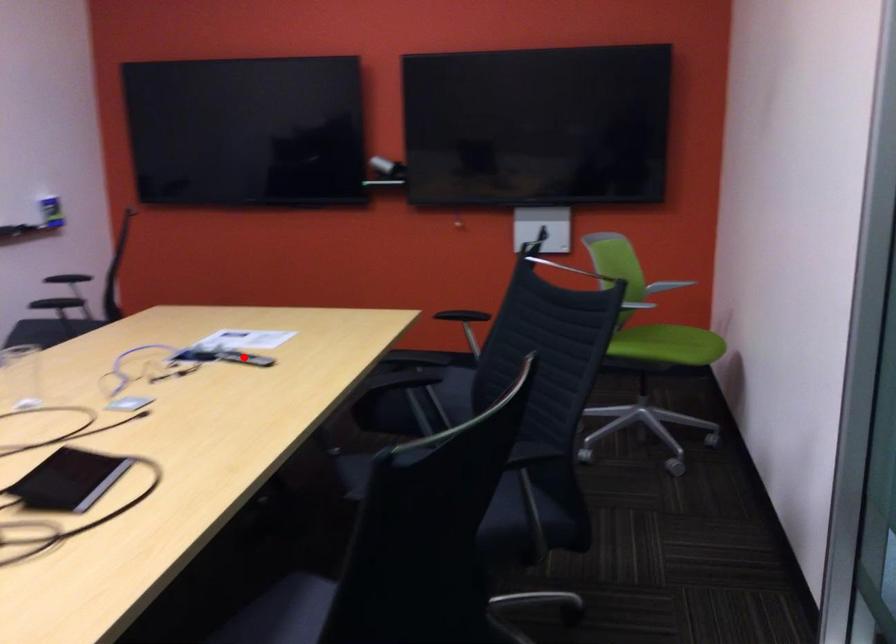
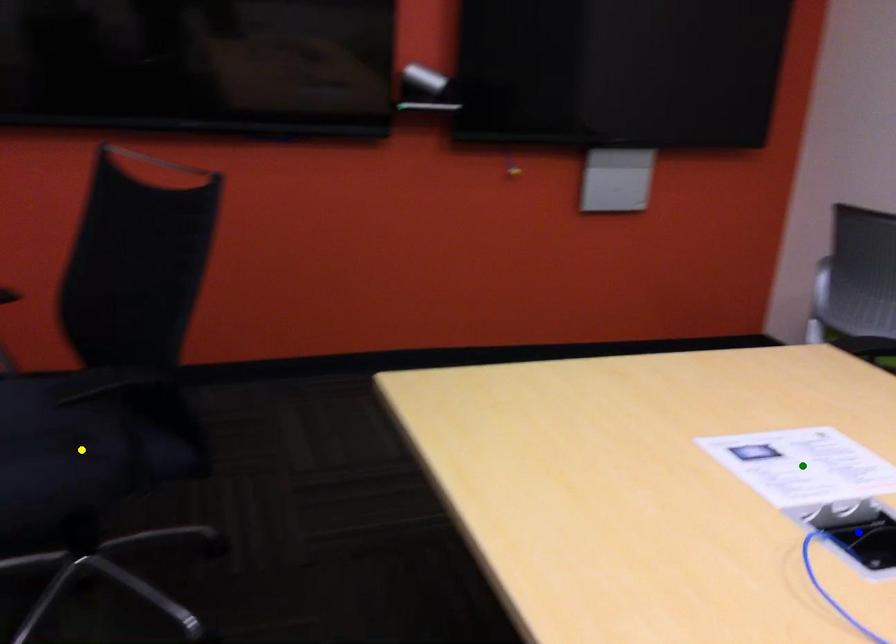
Question: I am providing you with two images of the same scene from different viewpoints. A red point is marked on the first image. You are given multiple points on the second image. Which mark in image 2 goes with the point in image 1?

Choices:
 (A) green point
 (B) blue point
 (C) yellow point

Answer: (B)